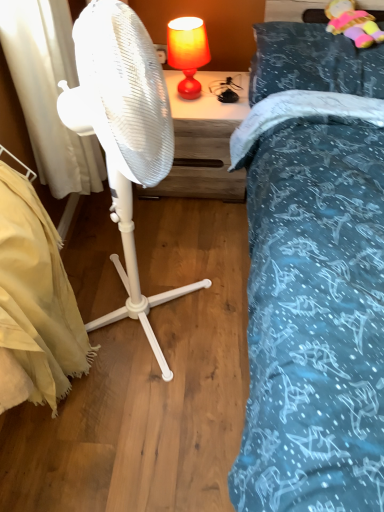
Find the location of a particular element. This screenshot has height=512, width=384. vacant area that is in front of beige fabric mattress at lower left is located at coordinates (74, 475).